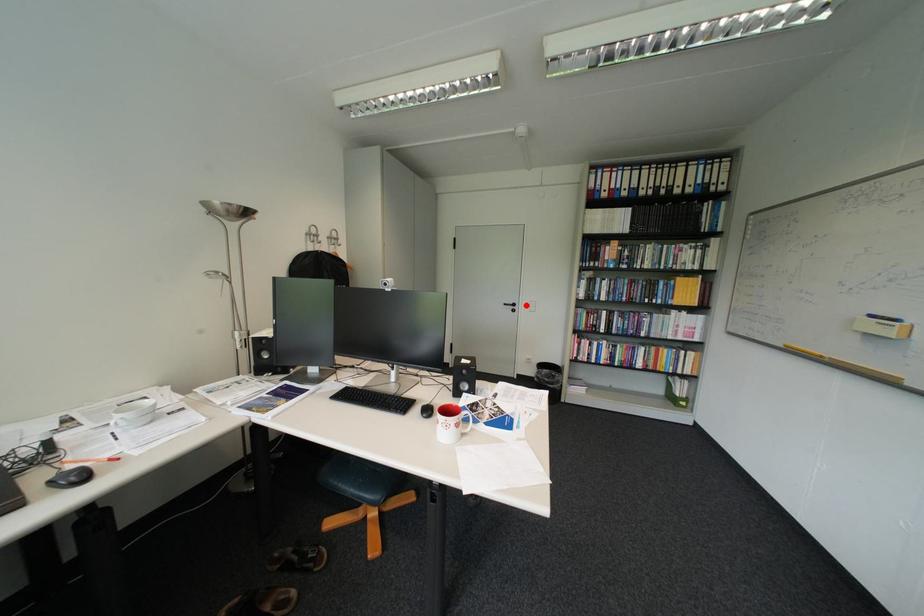
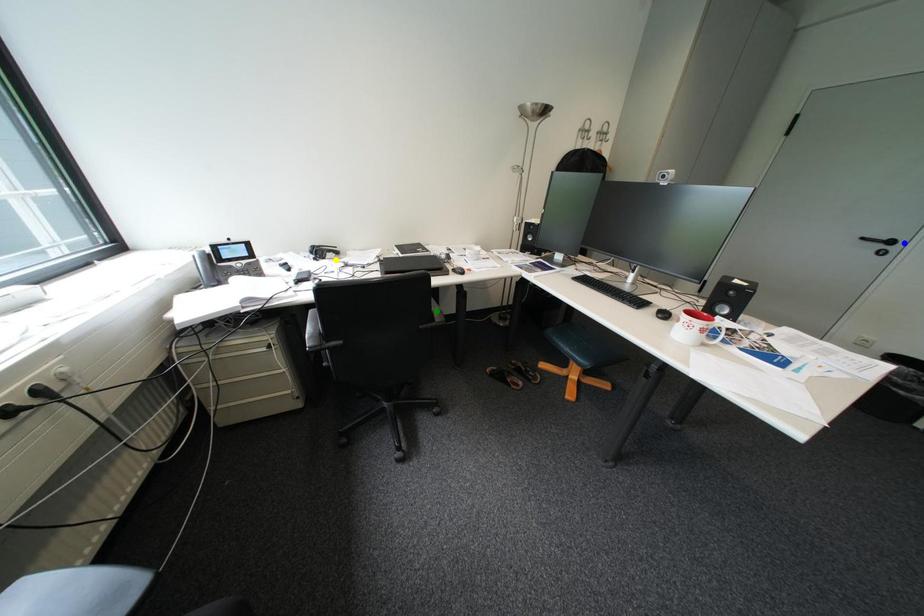
Question: I am providing you with two images of the same scene from different viewpoints. A red point is marked on the first image. You are given multiple points on the second image. Which spot in image 2 lines up with the point in image 1?

Choices:
 (A) blue point
 (B) yellow point
 (C) green point

Answer: (A)